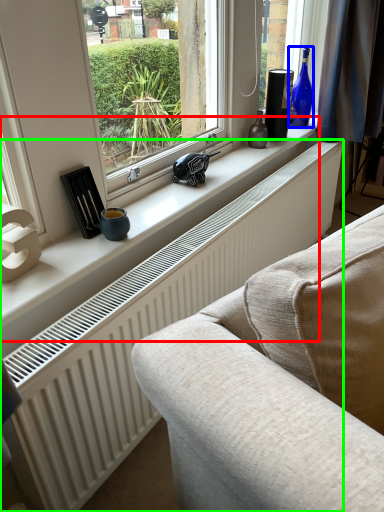
Question: Which is farther away from window sill (highlighted by a red box)? bottle (highlighted by a blue box) or radiator (highlighted by a green box)?

Choices:
 (A) bottle
 (B) radiator

Answer: (A)